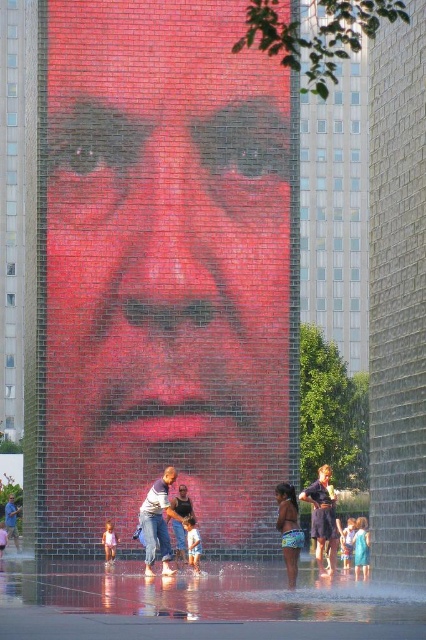
Does denim jeans at center lie behind dark blue denim shorts at lower right?

No, denim jeans at center is closer to the viewer.

Does point (163, 524) lie in front of point (336, 547)?

Yes, it is in front of point (336, 547).

Is point (155, 547) positioned behind point (316, 545)?

No, it is in front of (316, 545).

This screenshot has height=640, width=426. I want to click on denim jeans at center, so click(x=158, y=522).

Is smooth red face at center to the right of blue fabric dress at lower right from the viewer's perspective?

In fact, smooth red face at center is to the left of blue fabric dress at lower right.

Is point (55, 180) positioned in front of point (365, 518)?

Yes, it is in front of point (365, 518).

You are a GUI agent. You are given a task and a screenshot of the screen. Output one action in this format:
    pyautogui.click(x=<x>, y=<y>)
    Task: Click on the smooth red face at center
    This screenshot has width=426, height=640.
    Given the screenshot: What is the action you would take?
    pyautogui.click(x=166, y=266)

Is clear glass water at lower center closer to camera compared to blue patterned shorts at lower center?

That is True.

Between clear glass water at lower center and blue patterned shorts at lower center, which one appears on the right side from the viewer's perspective?

blue patterned shorts at lower center is more to the right.

Which is in front, point (241, 605) or point (296, 506)?

Positioned in front is point (241, 605).

This screenshot has height=640, width=426. In order to click on clear glass water at lower center in this screenshot , I will do `click(207, 593)`.